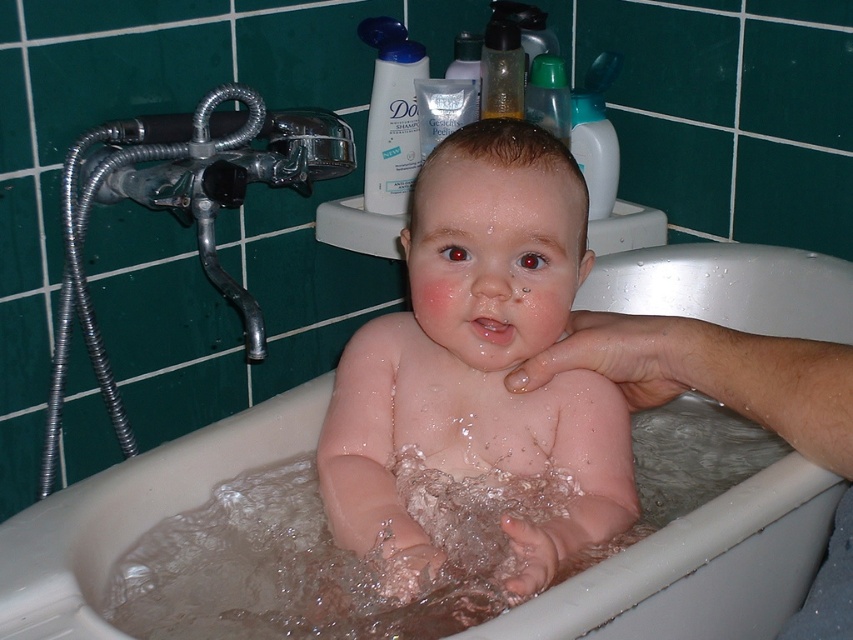
Question: Does pink smooth skin at center lie in front of white plastic bathtub at center?

Choices:
 (A) no
 (B) yes

Answer: (A)

Question: Which object appears farthest from the camera in this image?

Choices:
 (A) white plastic bathtub at center
 (B) pink smooth skin at center

Answer: (B)

Question: Where is pink smooth skin at center located in relation to white plastic bathtub at center in the image?

Choices:
 (A) below
 (B) above

Answer: (B)

Question: Does pink smooth skin at center appear on the left side of white plastic bathtub at center?

Choices:
 (A) no
 (B) yes

Answer: (B)

Question: Among these points, which one is farthest from the camera?

Choices:
 (A) (445, 378)
 (B) (686, 602)

Answer: (A)